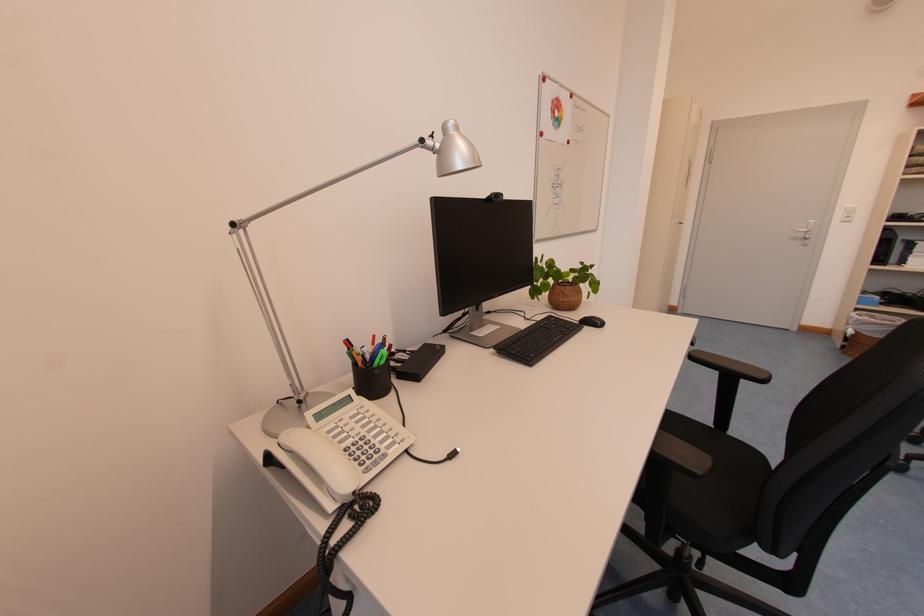
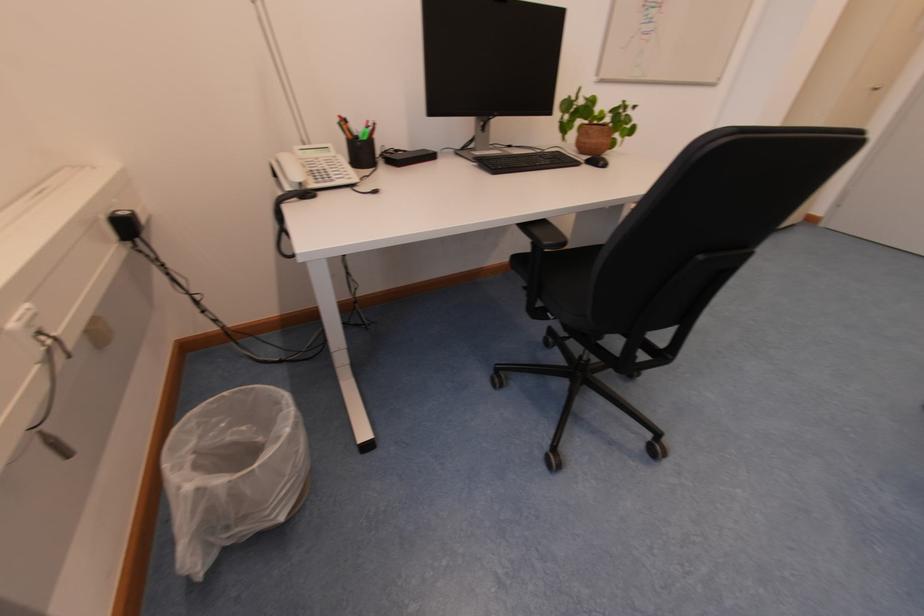
In the second image, find the point that corresponds to point 584,325 in the first image.

(590, 164)